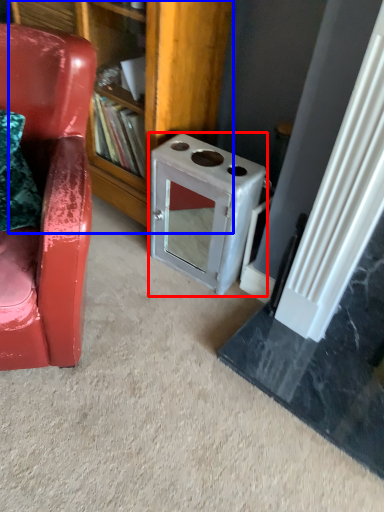
Question: Which of the following is the closest to the observer, appliance (highlighted by a red box) or bookshelf (highlighted by a blue box)?

Choices:
 (A) appliance
 (B) bookshelf

Answer: (B)